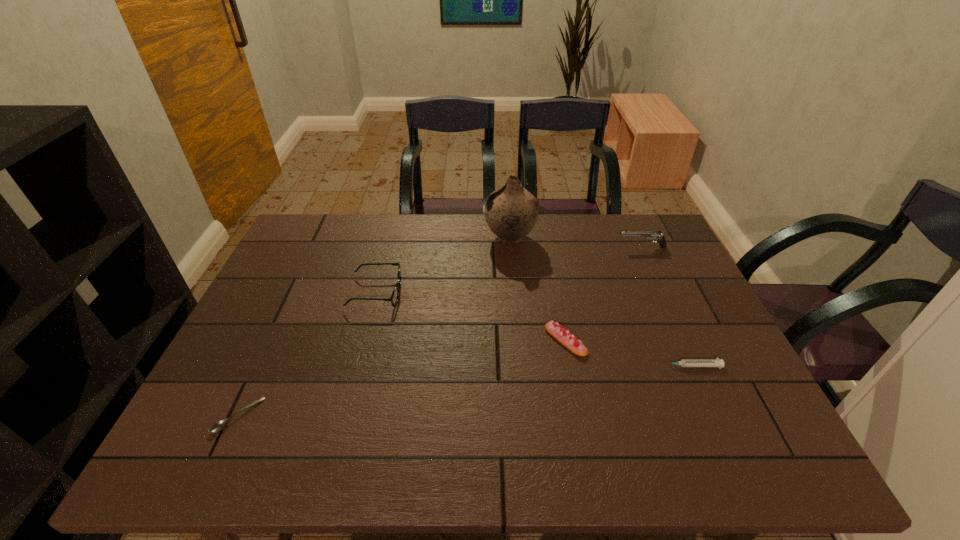
Locate an element on the screen. vacant space located 0.220m from the spout of the tallest object is located at coordinates (419, 238).

You are a GUI agent. You are given a task and a screenshot of the screen. Output one action in this format:
    pyautogui.click(x=<x>, y=<y>)
    Task: Click on the free location located from the spout of the tallest object
    The image size is (960, 540).
    Given the screenshot: What is the action you would take?
    pyautogui.click(x=457, y=238)

What are the coordinates of `free space located from the spout of the tallest object` in the screenshot? It's located at (413, 238).

Where is `vacant space positioned 0.060m on the front-facing side of the fifth shortest object`? The width and height of the screenshot is (960, 540). vacant space positioned 0.060m on the front-facing side of the fifth shortest object is located at coordinates (600, 247).

You are a GUI agent. You are given a task and a screenshot of the screen. Output one action in this format:
    pyautogui.click(x=<x>, y=<y>)
    Task: Click on the vacant region located on the front-facing side of the fifth shortest object
    Image resolution: width=960 pixels, height=540 pixels.
    Given the screenshot: What is the action you would take?
    pyautogui.click(x=572, y=247)

In order to click on vacant point located 0.140m on the front-facing side of the fifth shortest object in this screenshot , I will do [575, 247].

Locate an element on the screen. Image resolution: width=960 pixels, height=540 pixels. vacant space located on the front-facing side of the spectacles is located at coordinates (534, 293).

Locate an element on the screen. blank space located on the back of the fourth tallest object is located at coordinates (559, 306).

Where is `vacant region located at the needle end of the second shortest object`? Image resolution: width=960 pixels, height=540 pixels. vacant region located at the needle end of the second shortest object is located at coordinates (496, 366).

At what (x,y) coordinates should I click in order to perform the action: click on free space located 0.290m at the needle end of the second shortest object. Please return your answer as a coordinate pair (x, y). The image size is (960, 540). Looking at the image, I should click on (541, 366).